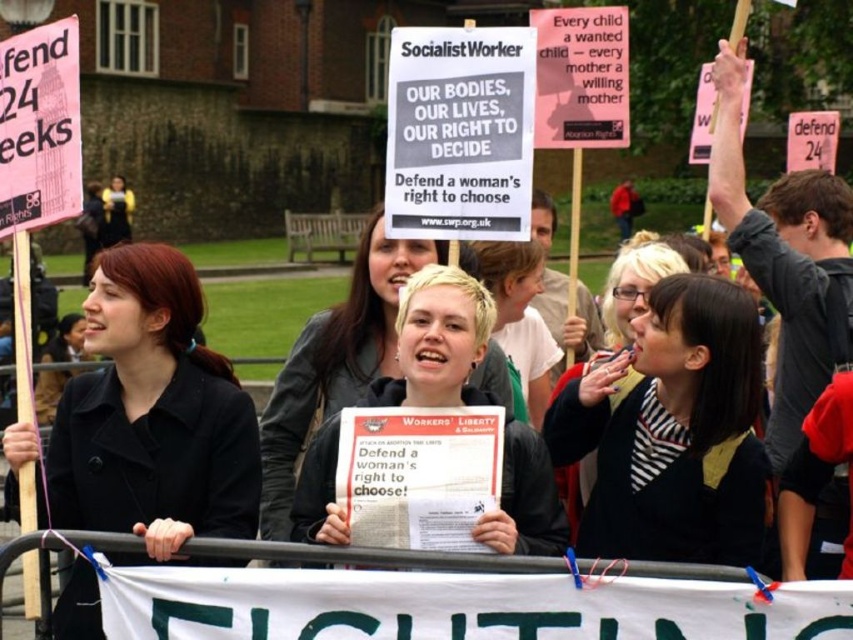
Can you confirm if striped fabric shirt at center is smaller than blonde hair at center?

Correct, striped fabric shirt at center occupies less space than blonde hair at center.

What are the coordinates of `striped fabric shirt at center` in the screenshot? It's located at (672, 432).

Where is `striped fabric shirt at center`? Image resolution: width=853 pixels, height=640 pixels. striped fabric shirt at center is located at coordinates (672, 432).

Can you confirm if matte black coat at left is thinner than blonde hair at center?

Incorrect, matte black coat at left's width is not less than blonde hair at center's.

Who is higher up, matte black coat at left or blonde hair at center?

matte black coat at left is above.

Is point (184, 561) positioned behind point (375, 228)?

That is False.

Image resolution: width=853 pixels, height=640 pixels. Find the location of `matte black coat at left`. matte black coat at left is located at coordinates (154, 417).

Does matte black coat at left lie behind striped fabric shirt at center?

No, it is not.

You are a GUI agent. You are given a task and a screenshot of the screen. Output one action in this format:
    pyautogui.click(x=<x>, y=<y>)
    Task: Click on the matte black coat at left
    The image size is (853, 640).
    Given the screenshot: What is the action you would take?
    pyautogui.click(x=154, y=417)